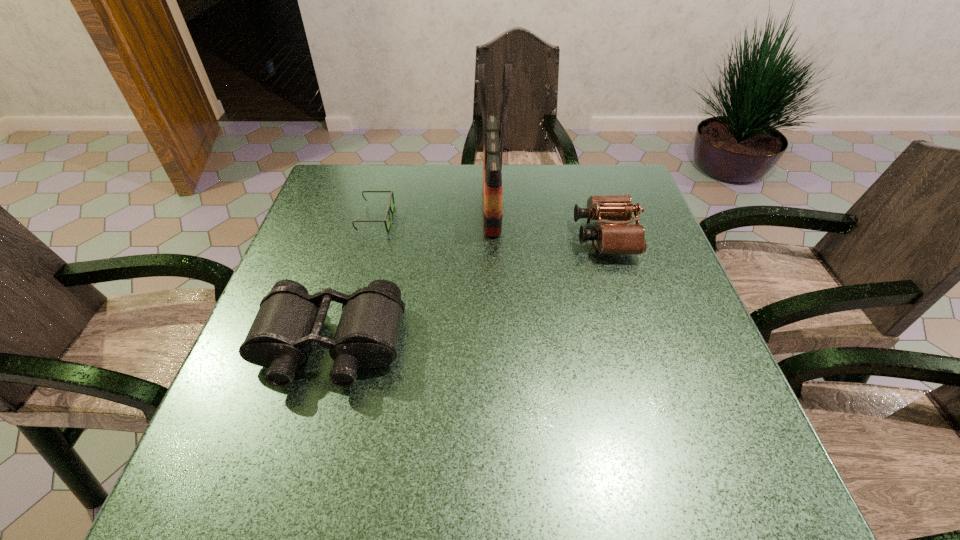
Where is `shopping bag`? This screenshot has width=960, height=540. shopping bag is located at coordinates (x=492, y=161).

In order to click on the tallest object in this screenshot , I will do `click(492, 161)`.

You are a GUI agent. You are given a task and a screenshot of the screen. Output one action in this format:
    pyautogui.click(x=<x>, y=<y>)
    Task: Click on the rightmost object
    The image size is (960, 540).
    Given the screenshot: What is the action you would take?
    pyautogui.click(x=618, y=237)

The height and width of the screenshot is (540, 960). In order to click on the right binoculars in this screenshot , I will do `click(618, 237)`.

Find the location of a particular element. The width and height of the screenshot is (960, 540). the nearest object is located at coordinates (289, 320).

In order to click on the nearer binoculars in this screenshot , I will do `click(289, 320)`.

Where is `the shortest object`? the shortest object is located at coordinates (389, 209).

Locate an element on the screen. The height and width of the screenshot is (540, 960). blank space located 0.380m on the front-facing side of the shopping bag is located at coordinates (341, 206).

Where is `free spot located 0.230m on the front-facing side of the shopping bag`? free spot located 0.230m on the front-facing side of the shopping bag is located at coordinates (396, 206).

In order to click on vacant point located on the front-facing side of the shopping bag in this screenshot , I will do `click(380, 206)`.